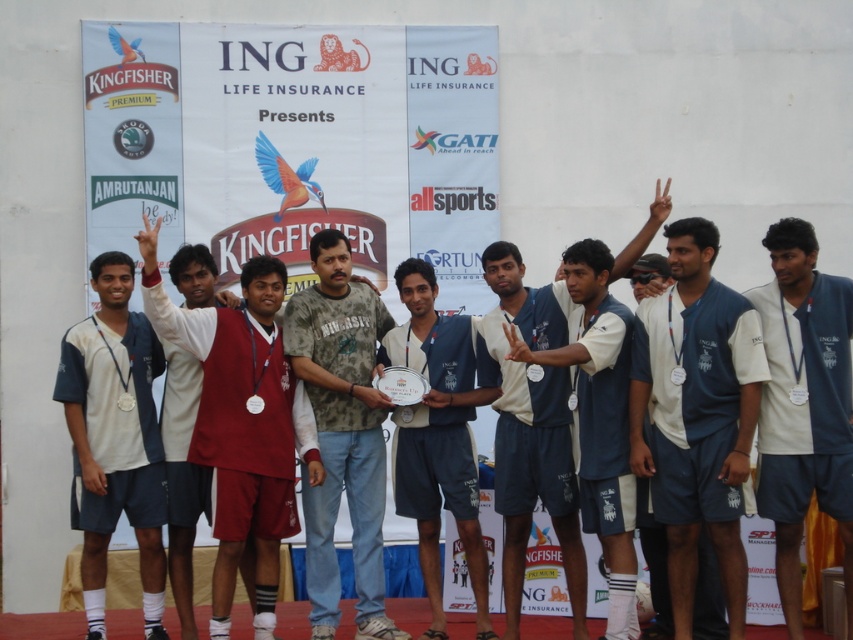
You are a photographer standing behind the stage. You need to take a photo of both the camouflage fabric shirt at center and the blue jersey at center. The camera you are using has a maximum focus range of 6 meters. Can you capture both subjects in focus without moving your position?

The camouflage fabric shirt at center is 6.77 meters from the blue jersey at center. Since the distance between them exceeds the camera maximum focus range of 6 meters, you cannot capture both subjects in focus without moving your position.

You are a photographer trying to capture a closeup of the maroon jersey at center and the camouflage fabric shirt at center. Given that your camera lens can only focus on objects within a 1.2 meter width, can you fit both items in the frame without moving closer?

The maroon jersey at center has a larger width than the camouflage fabric shirt at center. Since the total width of both items combined may exceed the 1.2 meter limit, it depends on their exact widths. However, the description only states the maroon jersey is wider, but not by how much. Without specific measurements, it is uncertain if they can both fit within the 1.2 meter frame width.

You are a photographer trying to capture a closeup of the Kingfisher Premium logo on the banner behind the group. You notice a point at coordinates (695, 416) on the image. Based on the description, is this point more likely on the banner or on the white fabric shirt at center?

The point (695, 416) is on the white fabric shirt at center, so it is more likely on the shirt rather than the banner.